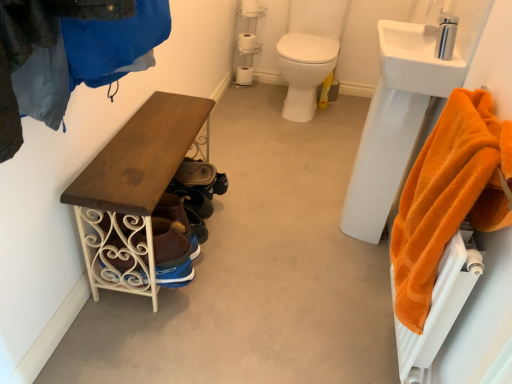
Question: In terms of size, does silver metallic faucet at upper right appear bigger or smaller than white ceramic sink at upper right?

Choices:
 (A) small
 (B) big

Answer: (A)

Question: Does point (451, 29) appear closer or farther from the camera than point (402, 74)?

Choices:
 (A) farther
 (B) closer

Answer: (B)

Question: Which is nearer to the orange plush towel at right?

Choices:
 (A) wooden bench at left
 (B) silver metallic faucet at upper right
 (C) white glossy toilet at center
 (D) white matte toilet paper at upper center, positioned as the second toilet paper in top-to-bottom order
 (E) wooden bench at left

Answer: (B)

Question: Which is nearer to the white glossy toilet at center?

Choices:
 (A) white matte toilet paper at upper center, which is the 1th toilet paper in front-to-back order
 (B) leather shoe at center
 (C) white plastic shelf at center
 (D) wooden bench at left
 (E) white ceramic sink at upper right

Answer: (C)